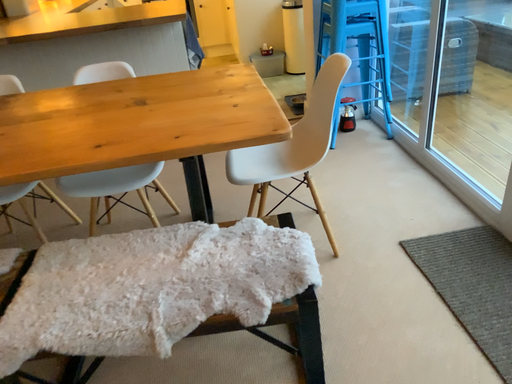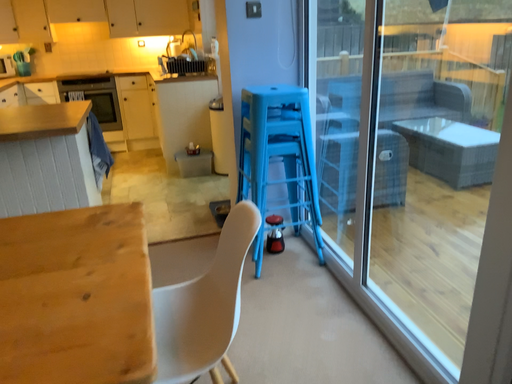
Question: How did the camera likely rotate when shooting the video?

Choices:
 (A) rotated upward
 (B) rotated downward

Answer: (A)